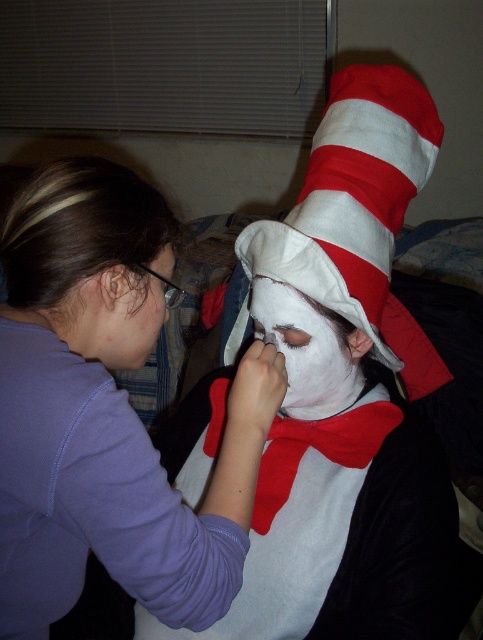
Is purple fabric at upper left positioned before white fabric hat at center?

Yes.

I want to click on purple fabric at upper left, so click(108, 410).

I want to click on purple fabric at upper left, so click(x=108, y=410).

Does white matte face paint at center have a smaller size compared to white fabric hat at center?

No, white matte face paint at center is not smaller than white fabric hat at center.

How much distance is there between white matte face paint at center and white fabric hat at center?

white matte face paint at center and white fabric hat at center are 7.27 inches apart from each other.

What do you see at coordinates (338, 497) in the screenshot? Image resolution: width=483 pixels, height=640 pixels. I see `white matte face paint at center` at bounding box center [338, 497].

Identify the location of white matte face paint at center. The image size is (483, 640). (338, 497).

Looking at this image, which is above, purple fabric at upper left or white matte face paint at center?

Positioned higher is purple fabric at upper left.

Does purple fabric at upper left have a greater width compared to white matte face paint at center?

In fact, purple fabric at upper left might be narrower than white matte face paint at center.

Is point (23, 240) positioned before point (371, 448)?

Yes, point (23, 240) is in front of point (371, 448).

The height and width of the screenshot is (640, 483). What are the coordinates of `purple fabric at upper left` in the screenshot? It's located at (108, 410).